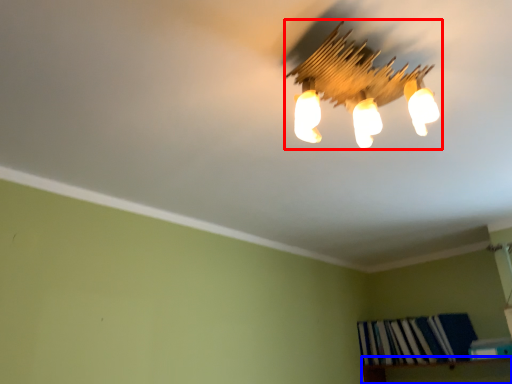
Question: Among these objects, which one is farthest to the camera, lamp (highlighted by a red box) or shelf (highlighted by a blue box)?

Choices:
 (A) lamp
 (B) shelf

Answer: (B)